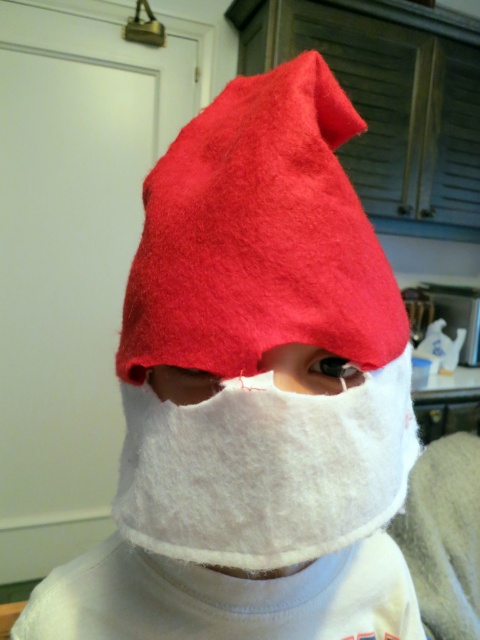
You are designing a storage box for the items in the kitchen. The matte felt hat at upper center and the white felt mask at center need to be placed inside. Based on their sizes, which item should be placed in the taller compartment?

The matte felt hat at upper center should be placed in the taller compartment since it is much taller than the white felt mask at center.

You are a guest at a costume party and notice the matte felt hat at upper center and the white felt mask at center. Which object is closer to you from the perspective of someone standing in front of them?

The matte felt hat at upper center is closer to you because the white felt mask at center is positioned behind it.

You are a costume designer preparing for a play. You need to determine the placement of the white felt mask at center and the white soft fabric at center in the image. Which object is located below the other?

The white felt mask at center is positioned under the white soft fabric at center, meaning the mask is below the fabric.